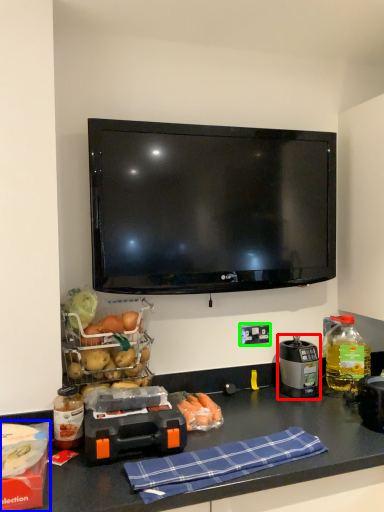
Question: Based on their relative distances, which object is farther from kitchen appliance (highlighted by a red box)? Choose from box (highlighted by a blue box) and electric outlet (highlighted by a green box).

Choices:
 (A) box
 (B) electric outlet

Answer: (A)